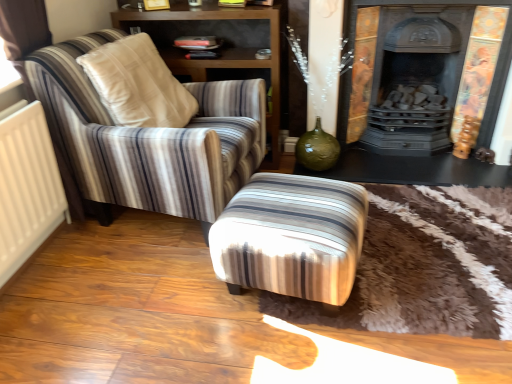
What are the coordinates of `vacant space to the right of striped fabric ottoman at center` in the screenshot? It's located at (407, 261).